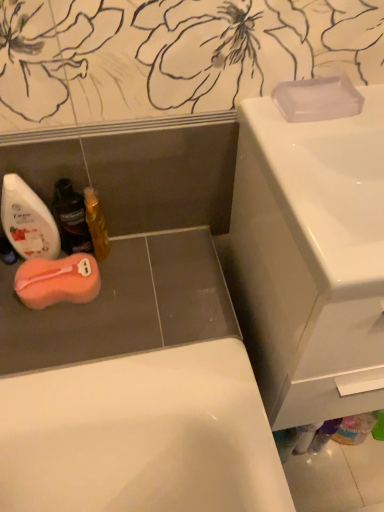
Question: Would you say shiny gold bottle at lower left, marked as the third mouthwash in a left-to-right arrangement, is outside translucent plastic mouthwash at lower left, the 3th mouthwash positioned from the right?

Choices:
 (A) no
 (B) yes

Answer: (B)

Question: Does shiny gold bottle at lower left, marked as the third mouthwash in a left-to-right arrangement, have a greater height compared to translucent plastic mouthwash at lower left, positioned as the 1th mouthwash in left-to-right order?

Choices:
 (A) yes
 (B) no

Answer: (B)

Question: Considering the relative positions of shiny gold bottle at lower left, marked as the third mouthwash in a left-to-right arrangement, and translucent plastic mouthwash at lower left, positioned as the 1th mouthwash in left-to-right order, in the image provided, is shiny gold bottle at lower left, marked as the third mouthwash in a left-to-right arrangement, to the left of translucent plastic mouthwash at lower left, positioned as the 1th mouthwash in left-to-right order, from the viewer's perspective?

Choices:
 (A) yes
 (B) no

Answer: (B)

Question: Is shiny gold bottle at lower left, marked as the third mouthwash in a left-to-right arrangement, wider than translucent plastic mouthwash at lower left, positioned as the 1th mouthwash in left-to-right order?

Choices:
 (A) no
 (B) yes

Answer: (A)

Question: Does shiny gold bottle at lower left, marked as the third mouthwash in a left-to-right arrangement, have a larger size compared to translucent plastic mouthwash at lower left, the 3th mouthwash positioned from the right?

Choices:
 (A) no
 (B) yes

Answer: (A)

Question: Could you tell me if shiny gold bottle at lower left, marked as the third mouthwash in a left-to-right arrangement, is turned towards translucent plastic mouthwash at lower left, the 3th mouthwash positioned from the right?

Choices:
 (A) no
 (B) yes

Answer: (A)

Question: Is translucent plastic mouthwash at lower left, the 3th mouthwash positioned from the right, positioned before pink sponge at lower left, the 2th soap viewed from the front?

Choices:
 (A) yes
 (B) no

Answer: (A)

Question: Is pink sponge at lower left, positioned as the 2th soap in top-to-bottom order, a part of translucent plastic mouthwash at lower left, positioned as the 1th mouthwash in left-to-right order?

Choices:
 (A) no
 (B) yes

Answer: (A)

Question: Is translucent plastic mouthwash at lower left, positioned as the 1th mouthwash in left-to-right order, not near pink sponge at lower left, which is the first soap from bottom to top?

Choices:
 (A) no
 (B) yes

Answer: (A)

Question: Does translucent plastic mouthwash at lower left, the 3th mouthwash positioned from the right, have a lesser height compared to pink sponge at lower left, the 2th soap viewed from the front?

Choices:
 (A) no
 (B) yes

Answer: (A)

Question: Considering the relative sizes of translucent plastic mouthwash at lower left, the 3th mouthwash positioned from the right, and pink sponge at lower left, the 2th soap viewed from the front, in the image provided, is translucent plastic mouthwash at lower left, the 3th mouthwash positioned from the right, taller than pink sponge at lower left, the 2th soap viewed from the front,?

Choices:
 (A) no
 (B) yes

Answer: (B)

Question: From a real-world perspective, is translucent plastic mouthwash at lower left, positioned as the 1th mouthwash in left-to-right order, located higher than pink sponge at lower left, placed as the 1th soap when sorted from left to right?

Choices:
 (A) no
 (B) yes

Answer: (B)

Question: Is white glossy sink at upper right oriented towards pink sponge at lower left, positioned as the 2th soap in top-to-bottom order?

Choices:
 (A) no
 (B) yes

Answer: (A)